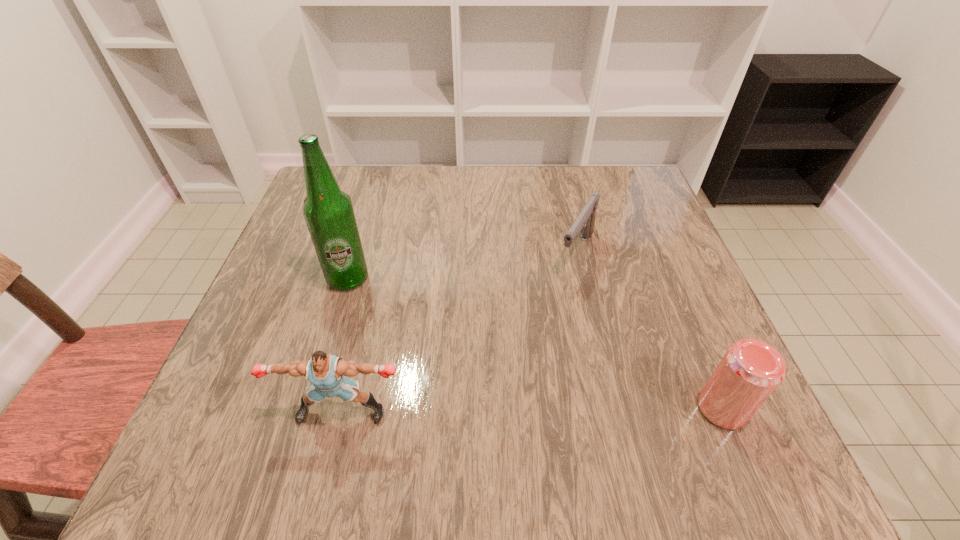
What are the coordinates of `free space on the desktop that is between the puncher and the rightmost object and is positioned at the barrel of the shortest object` in the screenshot? It's located at (481, 410).

The image size is (960, 540). What are the coordinates of `vacant space on the desktop that is between the puncher and the rightmost object and is positioned on the label of the tallest object` in the screenshot? It's located at (544, 410).